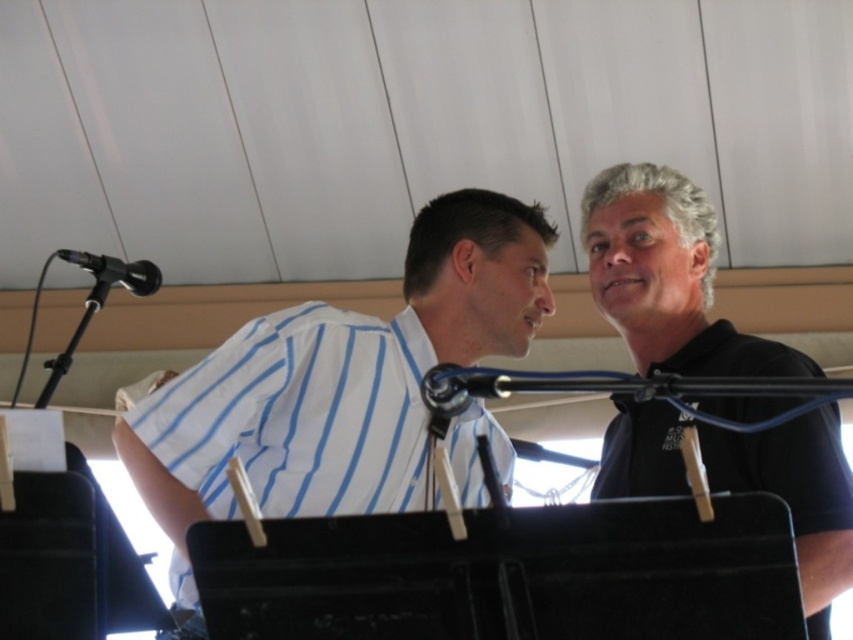
Question: Can you confirm if white striped shirt at center is thinner than black matte shirt at upper right?

Choices:
 (A) yes
 (B) no

Answer: (B)

Question: Does white striped shirt at center come in front of black matte shirt at upper right?

Choices:
 (A) yes
 (B) no

Answer: (B)

Question: Can you confirm if black matte shirt at upper right is positioned below black metallic microphone at upper left?

Choices:
 (A) no
 (B) yes

Answer: (B)

Question: Which point is farther to the camera?

Choices:
 (A) (635, 429)
 (B) (540, 221)
 (C) (99, 262)

Answer: (B)

Question: Among these points, which one is nearest to the camera?

Choices:
 (A) (65, 259)
 (B) (722, 451)

Answer: (B)

Question: Which object is positioned farthest from the black matte shirt at upper right?

Choices:
 (A) white striped shirt at center
 (B) black metallic microphone at upper left

Answer: (B)